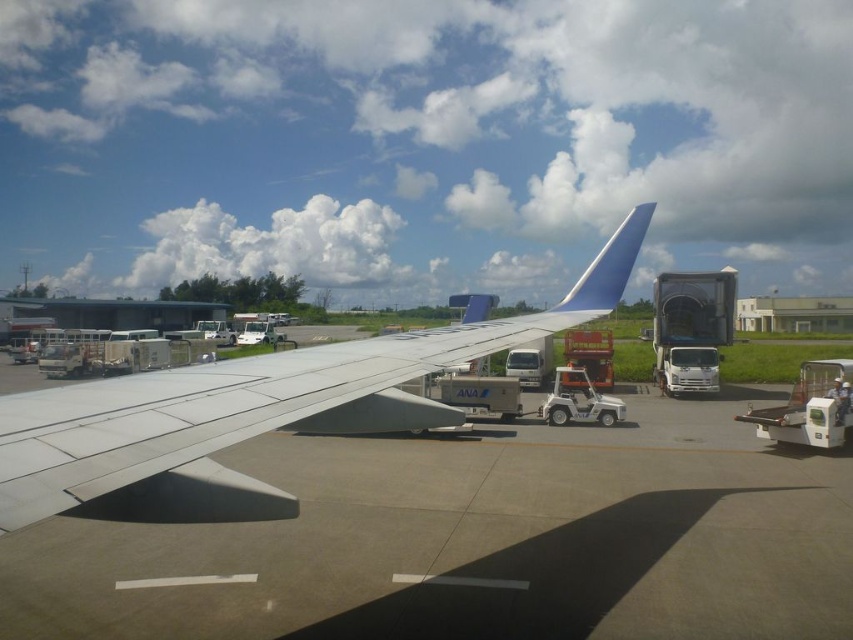
What do you see at coordinates (252, 410) in the screenshot? I see `white matte airplane wing at center` at bounding box center [252, 410].

You are a GUI agent. You are given a task and a screenshot of the screen. Output one action in this format:
    pyautogui.click(x=<x>, y=<y>)
    Task: Click on the white matte airplane wing at center
    Image resolution: width=853 pixels, height=640 pixels.
    Given the screenshot: What is the action you would take?
    pyautogui.click(x=252, y=410)

You are a GUI agent. You are given a task and a screenshot of the screen. Output one action in this format:
    pyautogui.click(x=<x>, y=<y>)
    Task: Click on the white matte airplane wing at center
    
    Given the screenshot: What is the action you would take?
    pyautogui.click(x=252, y=410)